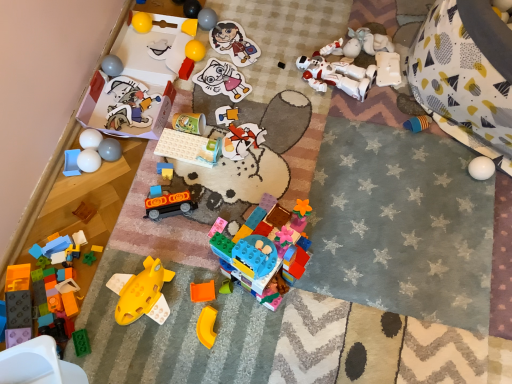
This screenshot has width=512, height=384. In order to click on free space between white plastic robot at upper right, which appears as the second toy when viewed from the right, and orange matte toy airplane at center, the 16th toy positioned from the left in this screenshot , I will do `click(323, 150)`.